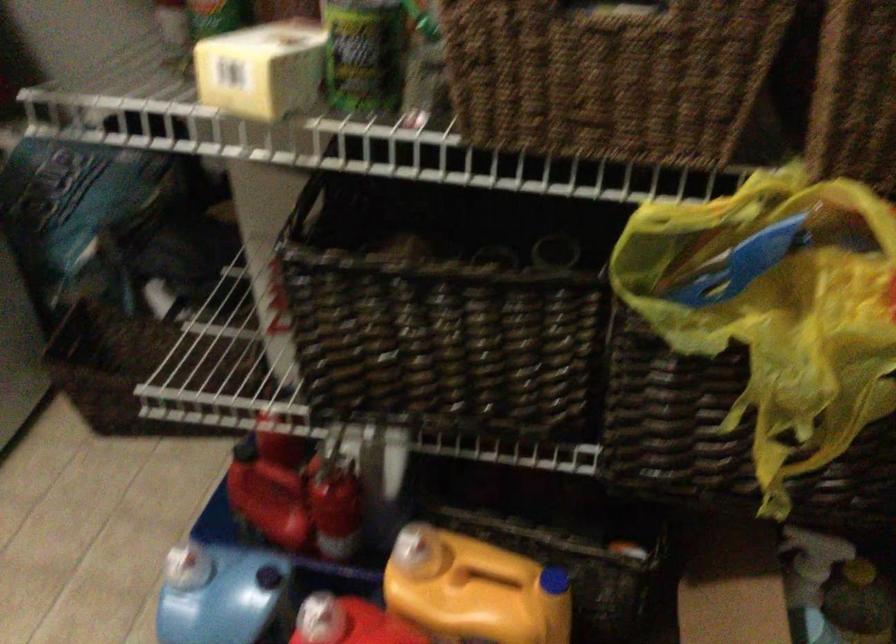
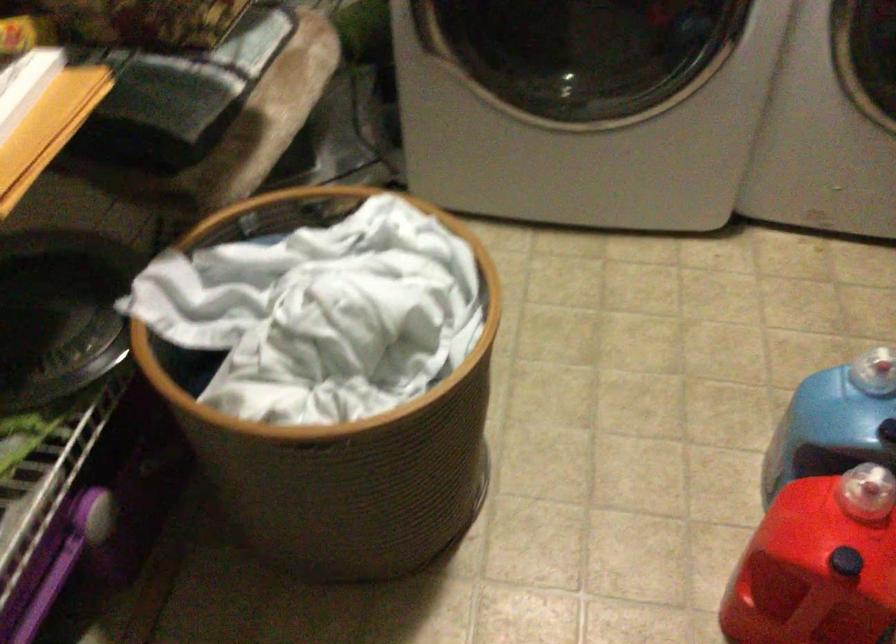
Based on the continuous images, in which direction is the camera rotating?

The camera's rotation is toward left-down.